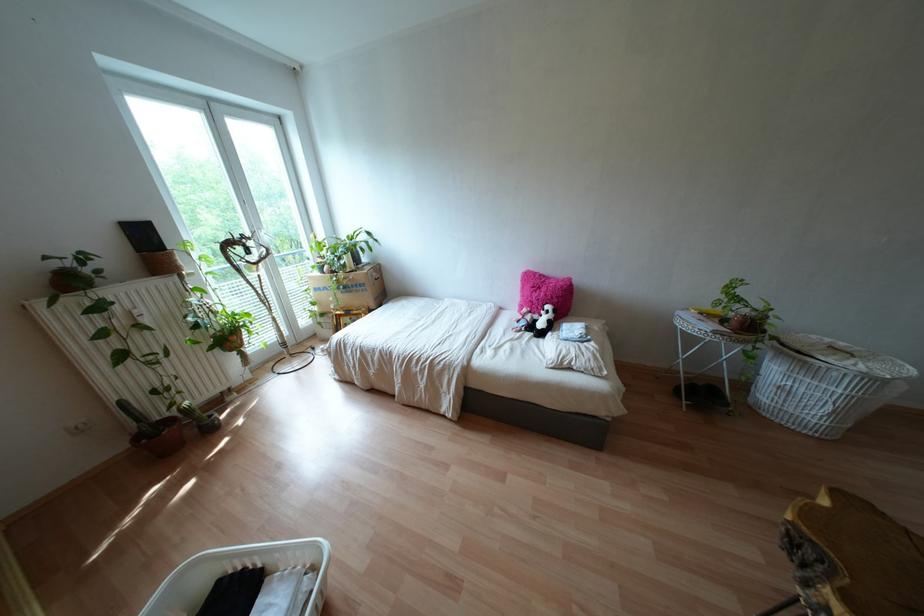
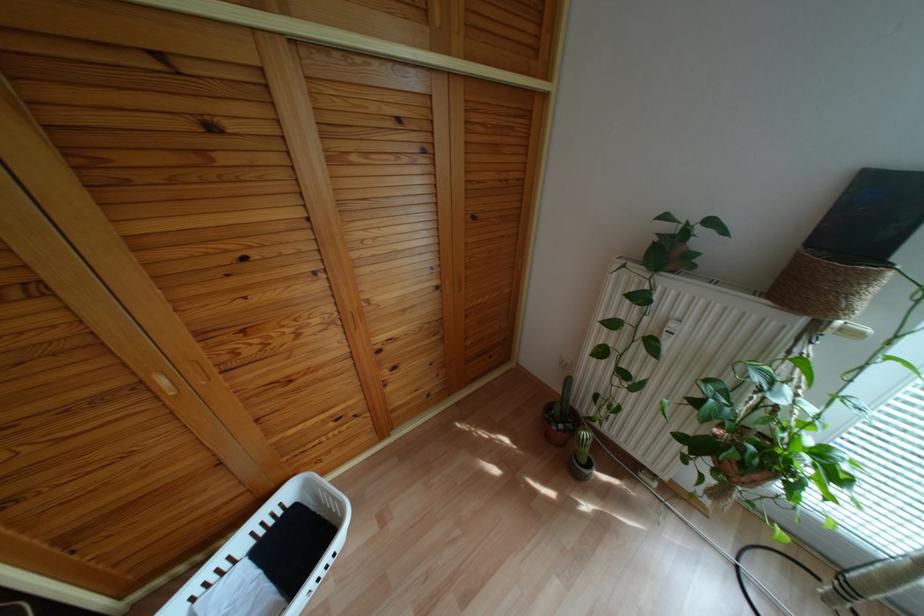
The point at (180,262) is marked in the first image. Where is the corresponding point in the second image?

(861, 302)